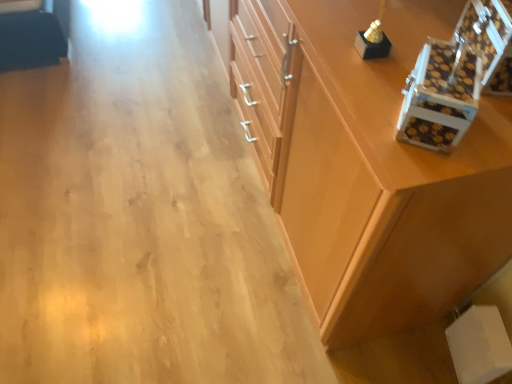
Question: Considering the relative sizes of white textured box at upper right, the second box in the right-to-left sequence, and brown checkered box at upper right, which appears as the first box when viewed from the right, in the image provided, is white textured box at upper right, the second box in the right-to-left sequence, thinner than brown checkered box at upper right, which appears as the first box when viewed from the right,?

Choices:
 (A) yes
 (B) no

Answer: (A)

Question: Can you confirm if white textured box at upper right, marked as the 1th box in a left-to-right arrangement, is wider than brown checkered box at upper right, which appears as the first box when viewed from the right?

Choices:
 (A) yes
 (B) no

Answer: (B)

Question: Is white textured box at upper right, marked as the 1th box in a left-to-right arrangement, taller than brown checkered box at upper right, which appears as the first box when viewed from the right?

Choices:
 (A) no
 (B) yes

Answer: (A)

Question: Is white textured box at upper right, the second box in the right-to-left sequence, positioned beyond the bounds of brown checkered box at upper right, which is the second box from left to right?

Choices:
 (A) yes
 (B) no

Answer: (A)

Question: Are white textured box at upper right, marked as the 1th box in a left-to-right arrangement, and brown checkered box at upper right, which appears as the first box when viewed from the right, located far from each other?

Choices:
 (A) yes
 (B) no

Answer: (B)

Question: Considering the relative sizes of white textured box at upper right, marked as the 1th box in a left-to-right arrangement, and brown checkered box at upper right, which is the second box from left to right, in the image provided, is white textured box at upper right, marked as the 1th box in a left-to-right arrangement, bigger than brown checkered box at upper right, which is the second box from left to right,?

Choices:
 (A) yes
 (B) no

Answer: (B)

Question: Can you confirm if wooden cabinet at center is positioned to the left of brown checkered box at upper right, which is the second box from left to right?

Choices:
 (A) no
 (B) yes

Answer: (B)

Question: Does wooden cabinet at center appear on the right side of brown checkered box at upper right, which is the second box from left to right?

Choices:
 (A) no
 (B) yes

Answer: (A)

Question: Is wooden cabinet at center looking in the opposite direction of brown checkered box at upper right, which is the second box from left to right?

Choices:
 (A) yes
 (B) no

Answer: (B)

Question: Is wooden cabinet at center directly adjacent to brown checkered box at upper right, which appears as the first box when viewed from the right?

Choices:
 (A) yes
 (B) no

Answer: (B)

Question: From the image's perspective, would you say wooden cabinet at center is positioned over brown checkered box at upper right, which is the second box from left to right?

Choices:
 (A) no
 (B) yes

Answer: (B)

Question: Does wooden cabinet at center have a lesser width compared to brown checkered box at upper right, which appears as the first box when viewed from the right?

Choices:
 (A) no
 (B) yes

Answer: (A)

Question: From a real-world perspective, is brown checkered box at upper right, which is the second box from left to right, under white textured box at upper right, marked as the 1th box in a left-to-right arrangement?

Choices:
 (A) yes
 (B) no

Answer: (B)